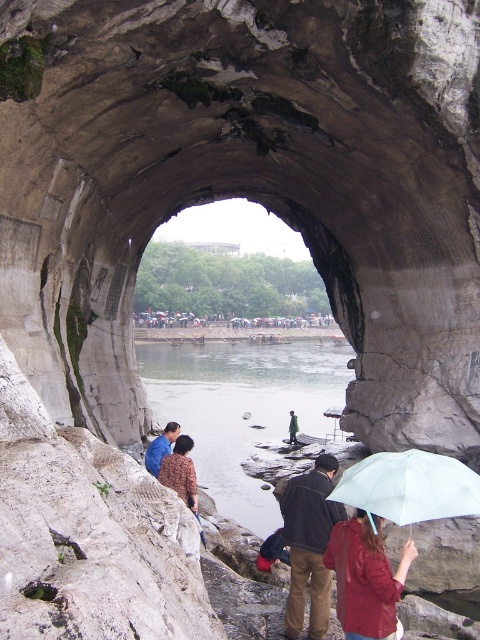
Question: Among these points, which one is farthest from the camera?

Choices:
 (A) (382, 579)
 (B) (172, 422)

Answer: (B)

Question: Which point is closer to the camera taking this photo?

Choices:
 (A) (147, 445)
 (B) (336, 513)
 (C) (165, 467)

Answer: (B)

Question: Can you confirm if light blue fabric umbrella at center is wider than green fabric jacket at center?

Choices:
 (A) no
 (B) yes

Answer: (B)

Question: Which of the following is the closest to the observer?

Choices:
 (A) (225, 458)
 (B) (330, 515)
 (C) (359, 609)
 (D) (193, 476)

Answer: (C)

Question: Can you confirm if clear water at center is bigger than green fabric jacket at center?

Choices:
 (A) yes
 (B) no

Answer: (A)

Question: Does light blue fabric umbrella at center appear on the right side of blue fabric shirt at center?

Choices:
 (A) yes
 (B) no

Answer: (A)